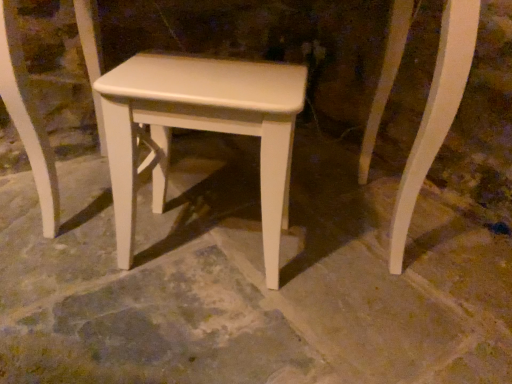
Describe the element at coordinates (201, 129) in the screenshot. I see `white matte stool at center` at that location.

Measure the distance between white matte stool at center and camera.

The depth of white matte stool at center is 29.52 inches.

I want to click on white matte stool at center, so click(201, 129).

Locate an element on the screen. The image size is (512, 384). white smooth concrete at center is located at coordinates (260, 276).

This screenshot has width=512, height=384. Describe the element at coordinates (260, 276) in the screenshot. I see `white smooth concrete at center` at that location.

Identify the location of white matte stool at center. (201, 129).

Would you say white matte stool at center is to the left or to the right of white smooth concrete at center in the picture?

From the image, it's evident that white matte stool at center is to the left of white smooth concrete at center.

Considering the relative positions of white matte stool at center and white smooth concrete at center in the image provided, is white matte stool at center behind white smooth concrete at center?

Yes, white matte stool at center is further from the camera.

Which is in front, point (233, 132) or point (4, 269)?

The point (233, 132) is in front.

From the image's perspective, is white matte stool at center on top of white smooth concrete at center?

Yes, from the image's perspective, white matte stool at center is over white smooth concrete at center.

From a real-world perspective, is white matte stool at center positioned over white smooth concrete at center based on gravity?

A: Yes, from a real-world perspective, white matte stool at center is over white smooth concrete at center

Which object is thinner, white matte stool at center or white smooth concrete at center?

Answer: white matte stool at center is thinner.

Who is taller, white matte stool at center or white smooth concrete at center?

white matte stool at center is taller.

Considering the sizes of objects white matte stool at center and white smooth concrete at center in the image provided, who is smaller, white matte stool at center or white smooth concrete at center?

white matte stool at center is smaller.

Looking at this image, does white matte stool at center contain white smooth concrete at center?

No, white smooth concrete at center is not a part of white matte stool at center.

Is the surface of white matte stool at center in direct contact with white smooth concrete at center?

They are not placed beside each other.

Is white matte stool at center looking in the opposite direction of white smooth concrete at center?

white matte stool at center is not turned away from white smooth concrete at center.

How many degrees apart are the facing directions of white matte stool at center and white smooth concrete at center?

41.6 degrees separate the facing orientations of white matte stool at center and white smooth concrete at center.

Measure the distance between white matte stool at center and white smooth concrete at center.

A distance of 10.91 inches exists between white matte stool at center and white smooth concrete at center.

Find the location of a particular element. concrete below the white matte stool at center (from the image's perspective) is located at coordinates (260, 276).

Does white smooth concrete at center appear on the left side of white matte stool at center?

In fact, white smooth concrete at center is to the right of white matte stool at center.

Is white smooth concrete at center positioned behind white matte stool at center?

No, it is in front of white matte stool at center.

Between point (193, 270) and point (157, 201), which one is positioned behind?

The point (157, 201) is farther.

From the image's perspective, is white smooth concrete at center beneath white matte stool at center?

Correct, white smooth concrete at center appears lower than white matte stool at center in the image.

From a real-world perspective, which is physically below, white smooth concrete at center or white matte stool at center?

white smooth concrete at center is physically lower.

Does white smooth concrete at center have a lesser width compared to white matte stool at center?

No.

Can you confirm if white smooth concrete at center is taller than white matte stool at center?

In fact, white smooth concrete at center may be shorter than white matte stool at center.

Looking at the image, does white smooth concrete at center seem bigger or smaller compared to white matte stool at center?

white smooth concrete at center is bigger than white matte stool at center.

Is white matte stool at center surrounded by white smooth concrete at center?

No, white smooth concrete at center does not contain white matte stool at center.

Is white smooth concrete at center not close to white matte stool at center?

white smooth concrete at center is near white matte stool at center, not far away.

From the picture: Could you tell me if white smooth concrete at center is facing white matte stool at center?

No, white smooth concrete at center is not oriented towards white matte stool at center.

Can you tell me how much white smooth concrete at center and white matte stool at center differ in facing direction?

The angular difference between white smooth concrete at center and white matte stool at center is 41.6 degrees.

Looking at this image, measure the distance from white smooth concrete at center to white matte stool at center.

They are 10.91 inches apart.

Identify the location of concrete that is below the white matte stool at center (from the image's perspective). Image resolution: width=512 pixels, height=384 pixels. (260, 276).

Find the location of `stool located above the white smooth concrete at center (from a real-world perspective)`. stool located above the white smooth concrete at center (from a real-world perspective) is located at coordinates (201, 129).

I want to click on concrete in front of the white matte stool at center, so click(x=260, y=276).